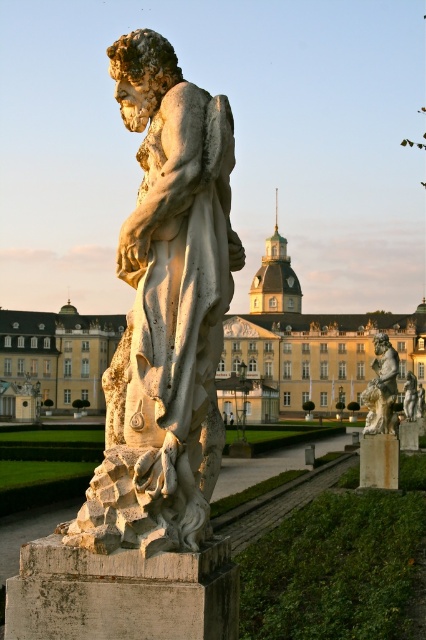
From the picture: What is located at the coordinates point (166, 310) in the image?

The white marble statue at center is located at point (166, 310).